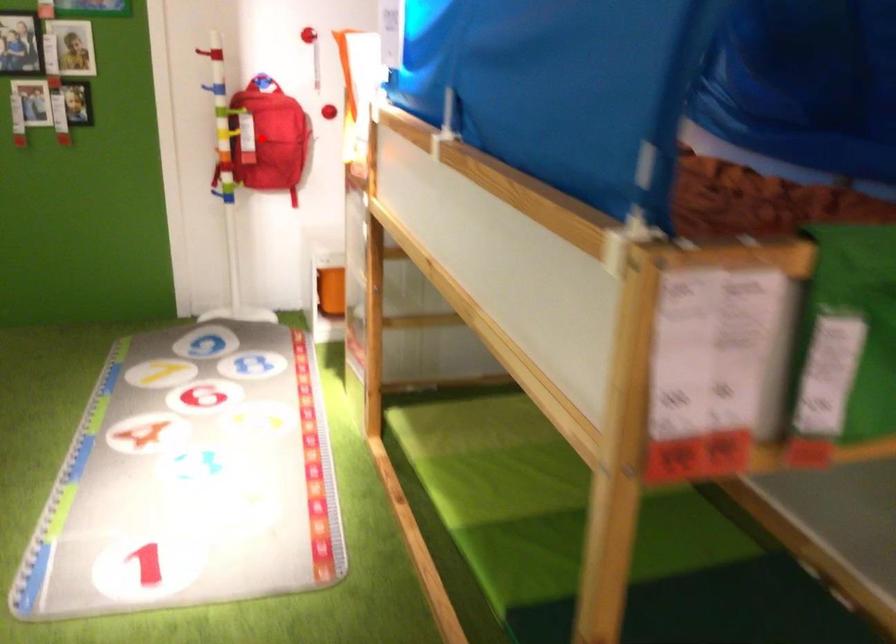
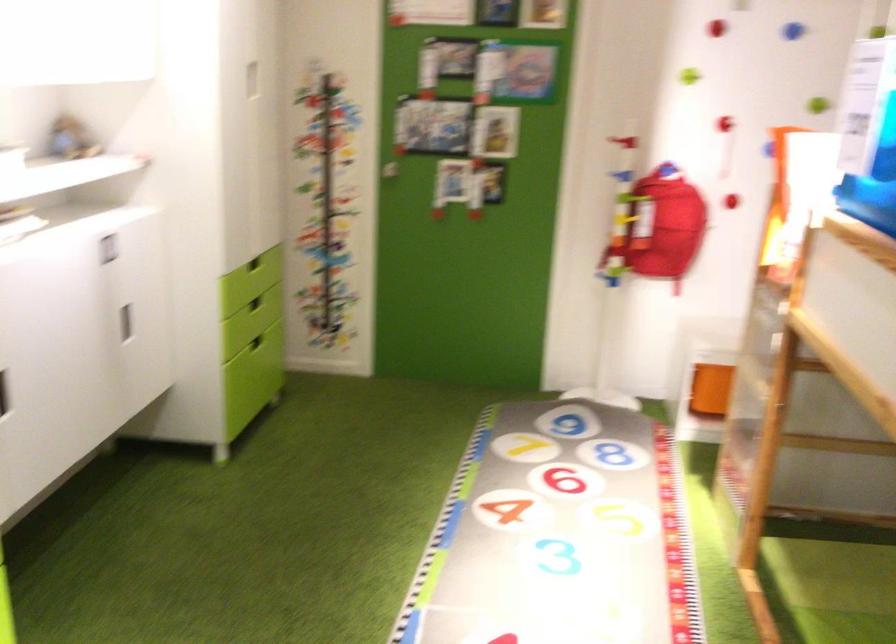
Locate, in the second image, the point that corresponds to the highlighted location in the first image.

(659, 227)